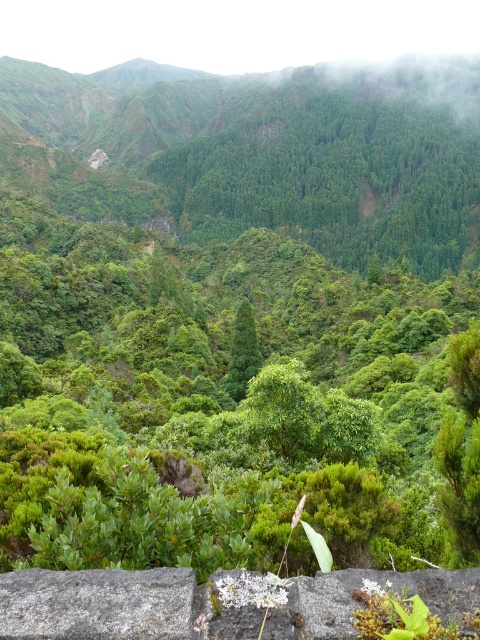
Question: Among these objects, which one is farthest from the camera?

Choices:
 (A) green leafy tree at center
 (B) gray rough stone at lower left
 (C) green leafy trees at center

Answer: (C)

Question: Is green leafy shrub at center positioned in front of gray rough stone at lower left?

Choices:
 (A) no
 (B) yes

Answer: (A)

Question: Does green leafy trees at center appear on the right side of green leafy tree at center?

Choices:
 (A) yes
 (B) no

Answer: (A)

Question: Is gray stone at lower center further to camera compared to green leafy tree at center?

Choices:
 (A) yes
 (B) no

Answer: (B)

Question: Which of the following is the closest to the observer?

Choices:
 (A) green leafy trees at center
 (B) gray stone at lower center
 (C) gray rough stone at lower left

Answer: (C)

Question: Based on their relative distances, which object is farther from the green leafy shrub at center?

Choices:
 (A) gray stone at lower center
 (B) green leafy tree at center

Answer: (A)